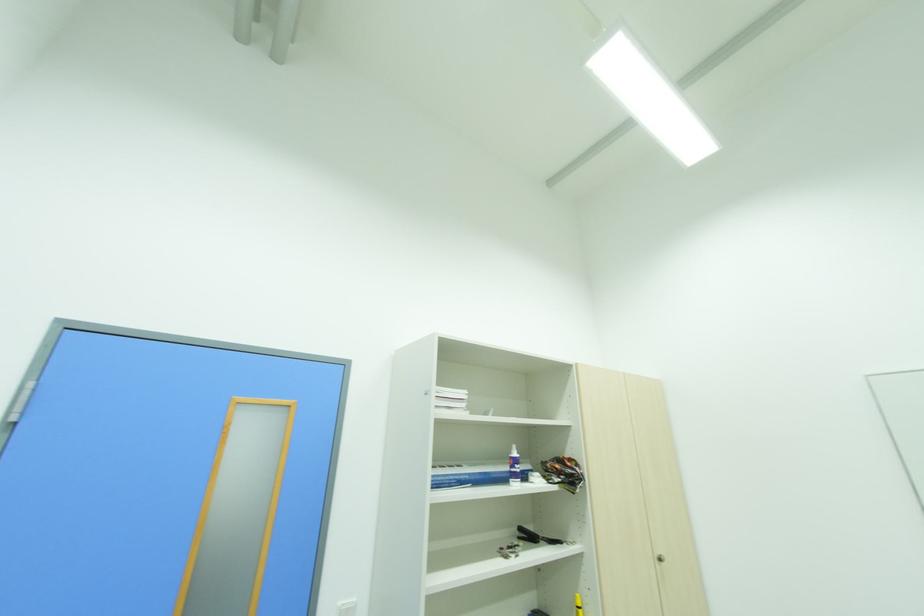
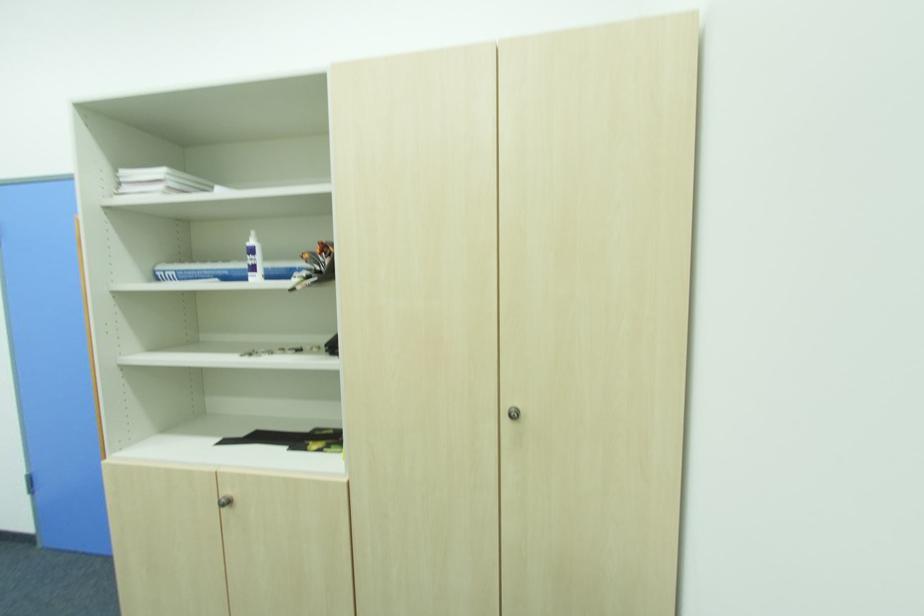
Where in the second image is the point corresponding to point (517, 455) from the first image?

(254, 243)